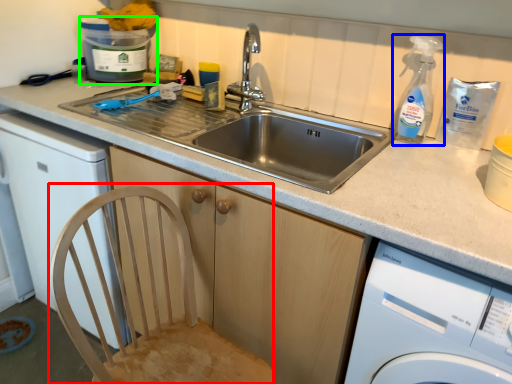
Question: Which object is positioned farthest from feeding chair (highlighted by a red box)? Select from cleaning product (highlighted by a blue box) and water cooler (highlighted by a green box).

Choices:
 (A) cleaning product
 (B) water cooler

Answer: (B)